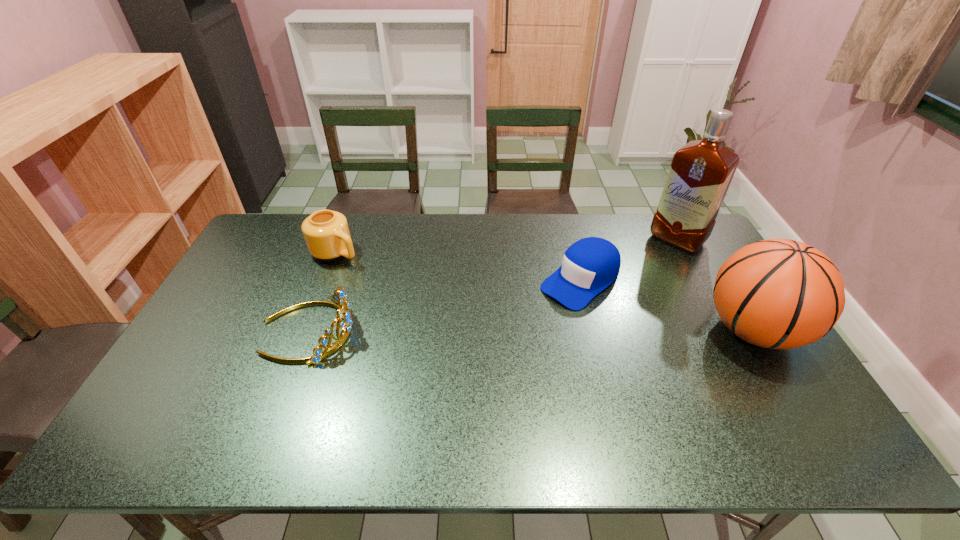
At what (x,y) coordinates should I click in order to perform the action: click on vacant space located 0.260m on the front-facing side of the baseball cap. Please return your answer as a coordinate pair (x, y). This screenshot has height=540, width=960. Looking at the image, I should click on (495, 349).

Where is `free region located on the front label of the liquor`? Image resolution: width=960 pixels, height=540 pixels. free region located on the front label of the liquor is located at coordinates (618, 298).

At what (x,y) coordinates should I click in order to perform the action: click on free region located 0.140m on the front label of the liquor. Please return your answer as a coordinate pair (x, y). The height and width of the screenshot is (540, 960). Looking at the image, I should click on (645, 272).

This screenshot has height=540, width=960. Find the location of `free spot located 0.360m on the front label of the liquor`. free spot located 0.360m on the front label of the liquor is located at coordinates (610, 307).

The height and width of the screenshot is (540, 960). In order to click on vacant space situated 0.210m on the handle side of the mug in this screenshot , I will do `click(396, 287)`.

You are a GUI agent. You are given a task and a screenshot of the screen. Output one action in this format:
    pyautogui.click(x=<x>, y=<y>)
    Task: Click on the vacant space positioned 0.400m on the handle side of the mug
    This screenshot has height=540, width=960.
    Given the screenshot: What is the action you would take?
    pyautogui.click(x=441, y=314)

This screenshot has width=960, height=540. I want to click on free space located on the handle side of the mug, so click(417, 300).

The width and height of the screenshot is (960, 540). What are the coordinates of `liquor that is positioned at the far edge` in the screenshot? It's located at (700, 174).

What are the coordinates of `mug that is at the far edge` in the screenshot? It's located at (326, 233).

At what (x,y) coordinates should I click in order to perform the action: click on basketball situated at the right edge. Please return your answer as a coordinate pair (x, y). The image size is (960, 540). Looking at the image, I should click on (782, 294).